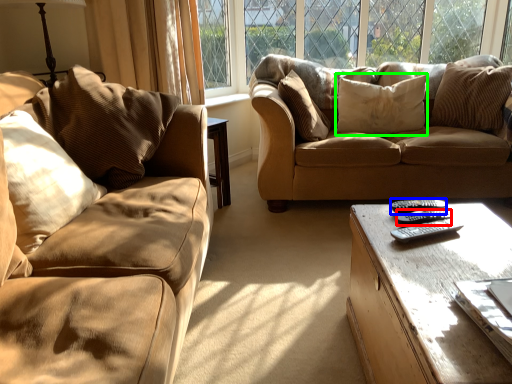
Question: Which object is the closest to the remote (highlighted by a red box)? Choose among these: remote (highlighted by a blue box) or pillow (highlighted by a green box).

Choices:
 (A) remote
 (B) pillow

Answer: (A)